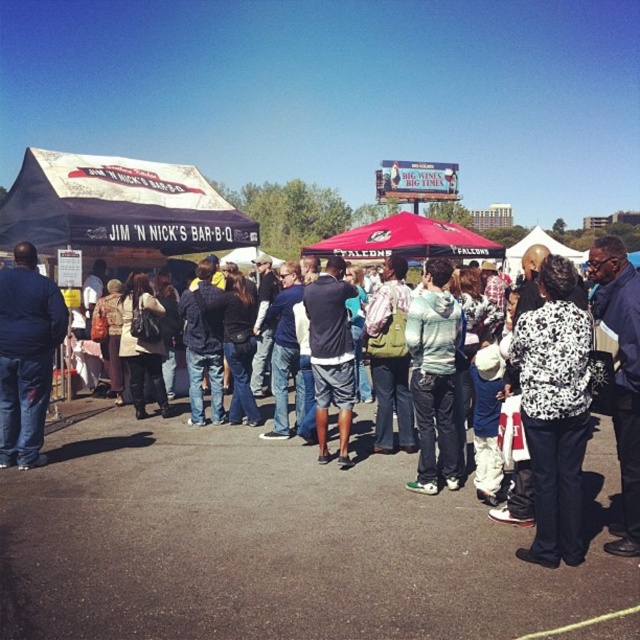
Question: Where is white printed sweater at center located in relation to light blue hoodie at center in the image?

Choices:
 (A) below
 (B) above

Answer: (A)

Question: Among these objects, which one is farthest from the camera?

Choices:
 (A) white printed sweater at center
 (B) white canvas tent at left
 (C) dark blue t-shirt at center

Answer: (B)

Question: Which point appears closest to the camera in this image?

Choices:
 (A) coord(340,244)
 (B) coord(444,417)

Answer: (B)

Question: Is white canvas tent at left behind dark blue t-shirt at center?

Choices:
 (A) no
 (B) yes

Answer: (B)

Question: Which is nearer to the light blue hoodie at center?

Choices:
 (A) dark blue t-shirt at center
 (B) white printed sweater at center
 (C) red fabric canopy at center
 (D) white canvas tent at left

Answer: (A)

Question: Is light blue hoodie at center smaller than red fabric canopy at center?

Choices:
 (A) no
 (B) yes

Answer: (B)